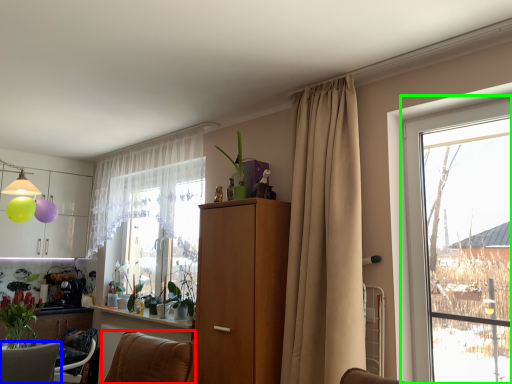
Question: Which is farther away from furniture (highlighted by a red box)? furniture (highlighted by a blue box) or window (highlighted by a green box)?

Choices:
 (A) furniture
 (B) window

Answer: (B)